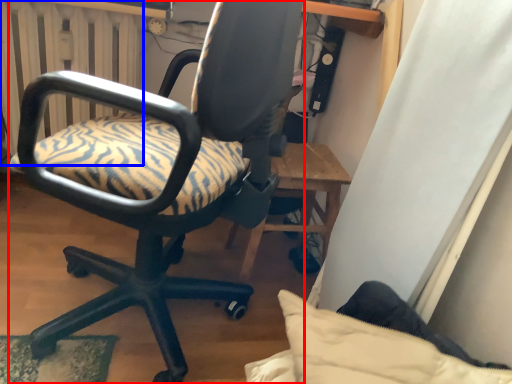
Question: Which object is further to the camera taking this photo, chair (highlighted by a red box) or radiator (highlighted by a blue box)?

Choices:
 (A) chair
 (B) radiator

Answer: (B)